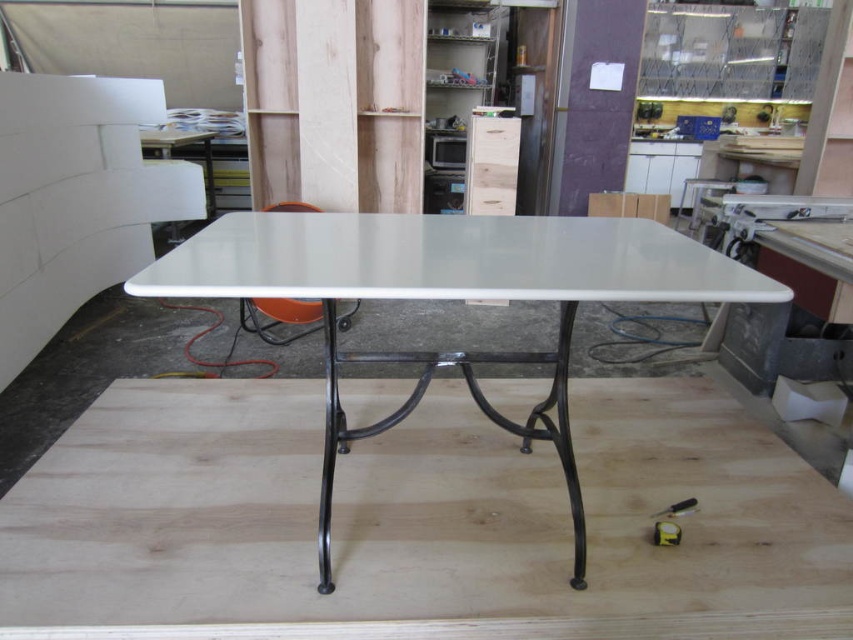
Question: Which point is farther to the camera?

Choices:
 (A) white glossy table at center
 (B) natural wood plywood at center

Answer: (B)

Question: Does natural wood plywood at center have a greater width compared to white glossy table at center?

Choices:
 (A) no
 (B) yes

Answer: (B)

Question: Does natural wood plywood at center appear over white glossy table at center?

Choices:
 (A) yes
 (B) no

Answer: (B)

Question: Is the position of natural wood plywood at center less distant than that of white glossy table at center?

Choices:
 (A) no
 (B) yes

Answer: (A)

Question: Which object appears closest to the camera in this image?

Choices:
 (A) natural wood plywood at center
 (B) white glossy table at center

Answer: (B)